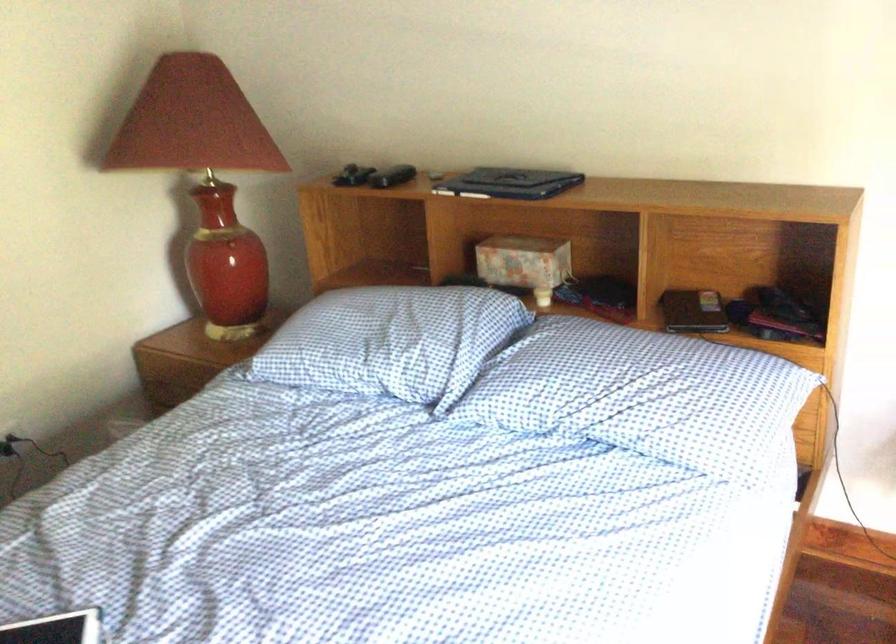
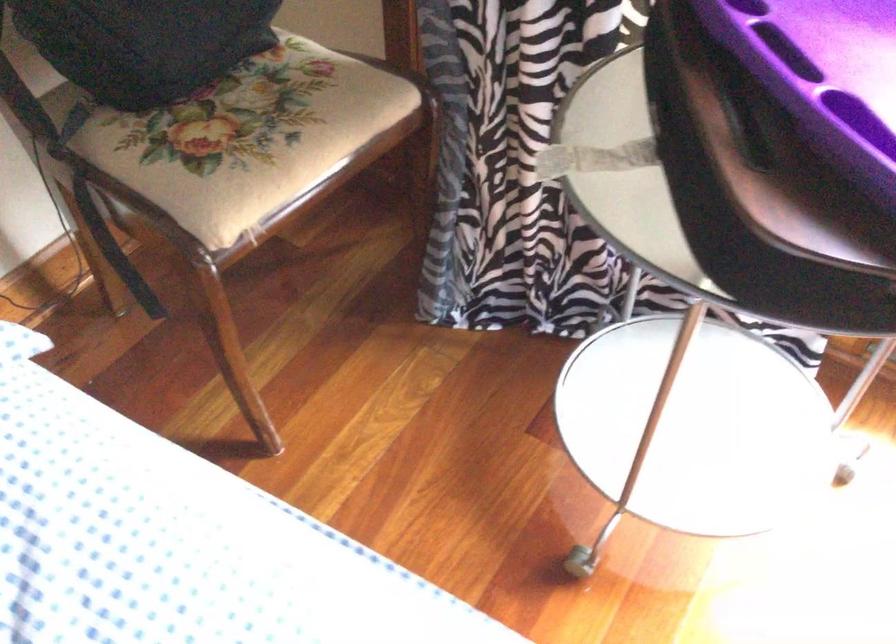
The first image is from the beginning of the video and the second image is from the end. How did the camera likely rotate when shooting the video?

The rotation direction of the camera is right-down.